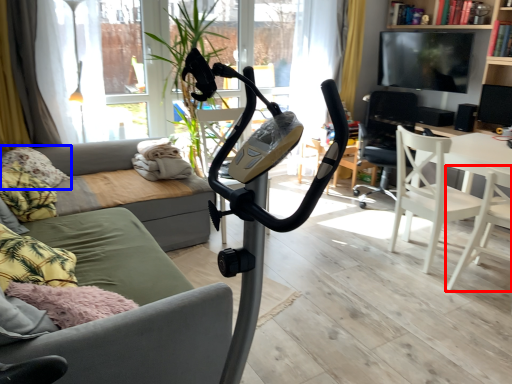
Question: Which object is closer to the camera taking this photo, chair (highlighted by a red box) or pillow (highlighted by a blue box)?

Choices:
 (A) chair
 (B) pillow

Answer: (A)